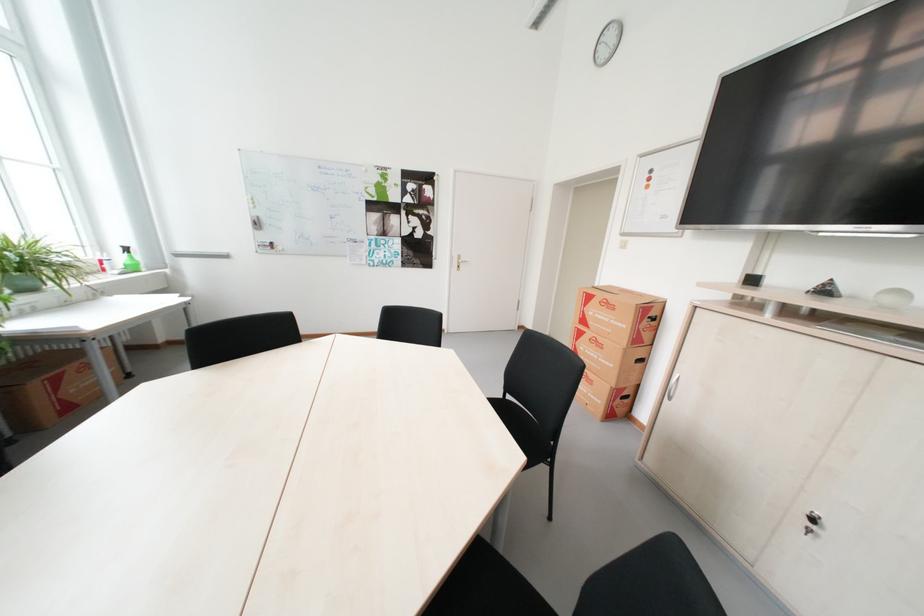
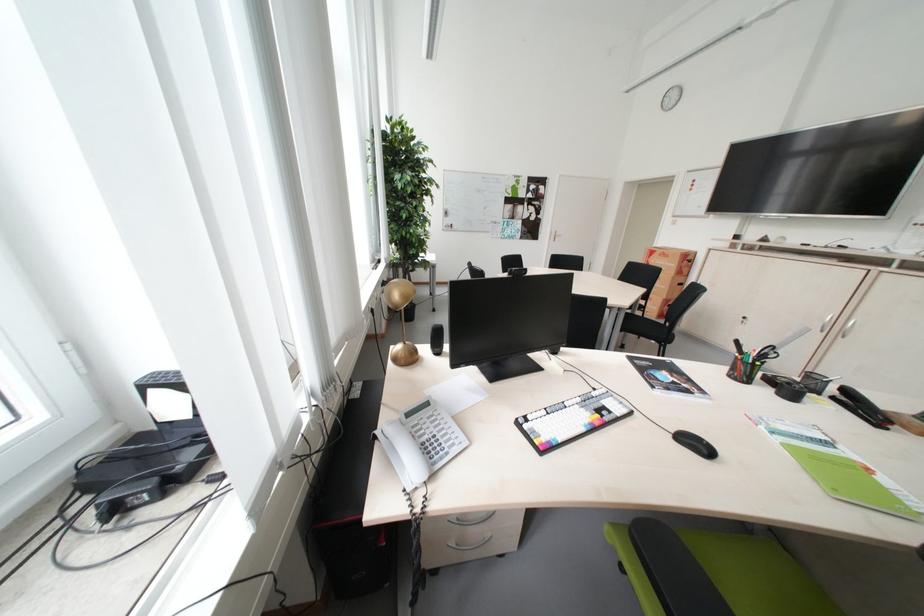
Which direction would the cameraman need to move to produce the second image?

The cameraman walked toward left, backward.